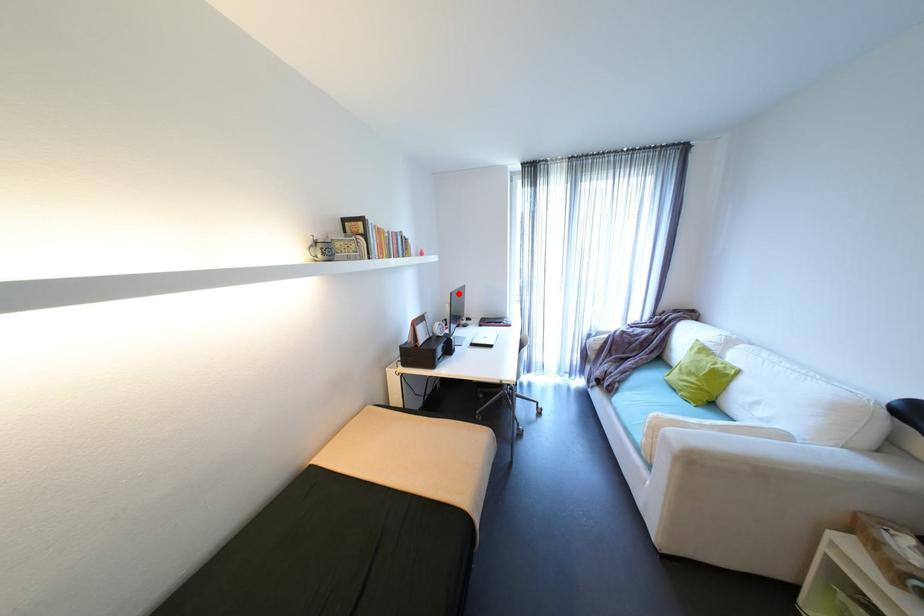
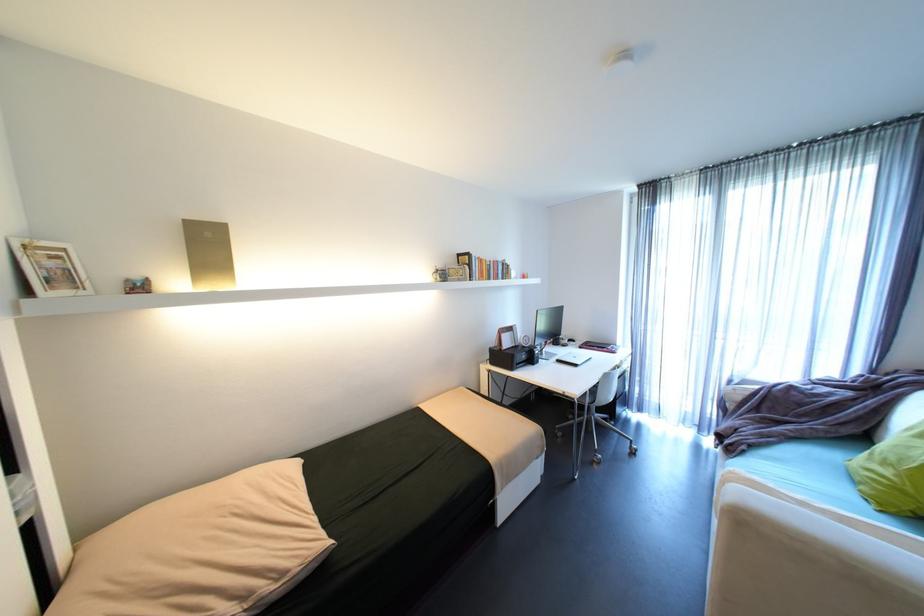
Locate, in the second image, the point that corresponds to the highlighted location in the first image.

(544, 310)